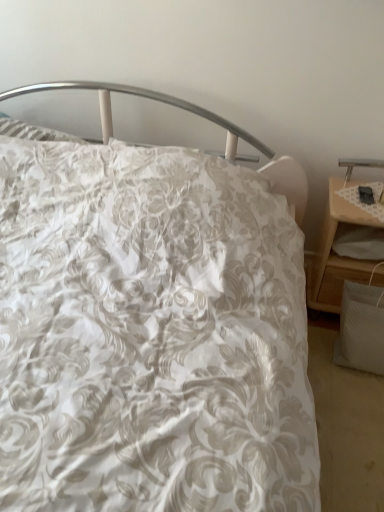
In order to face metallic silver table lamp at right, should I rotate leftwards or rightwards?

To face it directly, rotate right by 25.040 degrees.

The width and height of the screenshot is (384, 512). What do you see at coordinates (358, 165) in the screenshot? I see `metallic silver table lamp at right` at bounding box center [358, 165].

You are a GUI agent. You are given a task and a screenshot of the screen. Output one action in this format:
    pyautogui.click(x=<x>, y=<y>)
    Task: Click on the metallic silver table lamp at right
    The image size is (384, 512).
    Given the screenshot: What is the action you would take?
    pyautogui.click(x=358, y=165)

The width and height of the screenshot is (384, 512). Find the location of `wooden nightstand at right`. wooden nightstand at right is located at coordinates (335, 239).

The width and height of the screenshot is (384, 512). What do you see at coordinates (335, 239) in the screenshot? I see `wooden nightstand at right` at bounding box center [335, 239].

The width and height of the screenshot is (384, 512). What are the coordinates of `metallic silver table lamp at right` in the screenshot? It's located at (358, 165).

Is metallic silver table lamp at right to the right of wooden nightstand at right from the viewer's perspective?

Indeed, metallic silver table lamp at right is positioned on the right side of wooden nightstand at right.

Is metallic silver table lamp at right further to camera compared to wooden nightstand at right?

Yes, metallic silver table lamp at right is further from the camera.

Is point (383, 165) behind point (319, 285)?

No, it is in front of (319, 285).

From the image's perspective, is metallic silver table lamp at right located beneath wooden nightstand at right?

Actually, metallic silver table lamp at right appears above wooden nightstand at right in the image.

From a real-world perspective, is metallic silver table lamp at right below wooden nightstand at right?

No, from a real-world perspective, metallic silver table lamp at right is not below wooden nightstand at right.

Considering the relative sizes of metallic silver table lamp at right and wooden nightstand at right in the image provided, is metallic silver table lamp at right thinner than wooden nightstand at right?

Correct, the width of metallic silver table lamp at right is less than that of wooden nightstand at right.

Is metallic silver table lamp at right taller than wooden nightstand at right?

In fact, metallic silver table lamp at right may be shorter than wooden nightstand at right.

Who is smaller, metallic silver table lamp at right or wooden nightstand at right?

metallic silver table lamp at right.

Is metallic silver table lamp at right inside or outside of wooden nightstand at right?

metallic silver table lamp at right is spatially situated outside wooden nightstand at right.

Is metallic silver table lamp at right next to wooden nightstand at right?

They are not placed beside each other.

Is wooden nightstand at right at the back of metallic silver table lamp at right?

That's not correct — metallic silver table lamp at right is not looking away from wooden nightstand at right.

Can you tell me how much metallic silver table lamp at right and wooden nightstand at right differ in facing direction?

metallic silver table lamp at right and wooden nightstand at right are facing 0.0731 degrees away from each other.

This screenshot has width=384, height=512. Identify the location of table lamp lying behind the wooden nightstand at right. (358, 165).

Is wooden nightstand at right at the right side of metallic silver table lamp at right?

No, wooden nightstand at right is not to the right of metallic silver table lamp at right.

From the picture: In the image, is wooden nightstand at right positioned in front of or behind metallic silver table lamp at right?

In the image, wooden nightstand at right appears in front of metallic silver table lamp at right.

Considering the positions of points (334, 309) and (346, 174), is point (334, 309) closer to camera compared to point (346, 174)?

That is True.

From the image's perspective, does wooden nightstand at right appear lower than metallic silver table lamp at right?

Yes, from the image's perspective, wooden nightstand at right is beneath metallic silver table lamp at right.

Consider the image. From a real-world perspective, is wooden nightstand at right below metallic silver table lamp at right?

Yes, from a real-world perspective, wooden nightstand at right is below metallic silver table lamp at right.

Based on the photo, considering the sizes of objects wooden nightstand at right and metallic silver table lamp at right in the image provided, who is thinner, wooden nightstand at right or metallic silver table lamp at right?

metallic silver table lamp at right.

Which of these two, wooden nightstand at right or metallic silver table lamp at right, stands shorter?

With less height is metallic silver table lamp at right.

Is wooden nightstand at right bigger or smaller than metallic silver table lamp at right?

Clearly, wooden nightstand at right is larger in size than metallic silver table lamp at right.

Is metallic silver table lamp at right completely or partially inside wooden nightstand at right?

That's incorrect, metallic silver table lamp at right is not inside wooden nightstand at right.

Would you consider wooden nightstand at right to be distant from metallic silver table lamp at right?

wooden nightstand at right is actually quite close to metallic silver table lamp at right.

Is wooden nightstand at right aimed at metallic silver table lamp at right?

No, wooden nightstand at right is not oriented towards metallic silver table lamp at right.

Can you tell me how much wooden nightstand at right and metallic silver table lamp at right differ in facing direction?

The facing directions of wooden nightstand at right and metallic silver table lamp at right are 0.0731 degrees apart.

The width and height of the screenshot is (384, 512). I want to click on nightstand on the left of metallic silver table lamp at right, so click(x=335, y=239).

Image resolution: width=384 pixels, height=512 pixels. In order to click on table lamp lying on the right of wooden nightstand at right in this screenshot , I will do `click(358, 165)`.

This screenshot has height=512, width=384. Identify the location of nightstand on the left side of metallic silver table lamp at right. (335, 239).